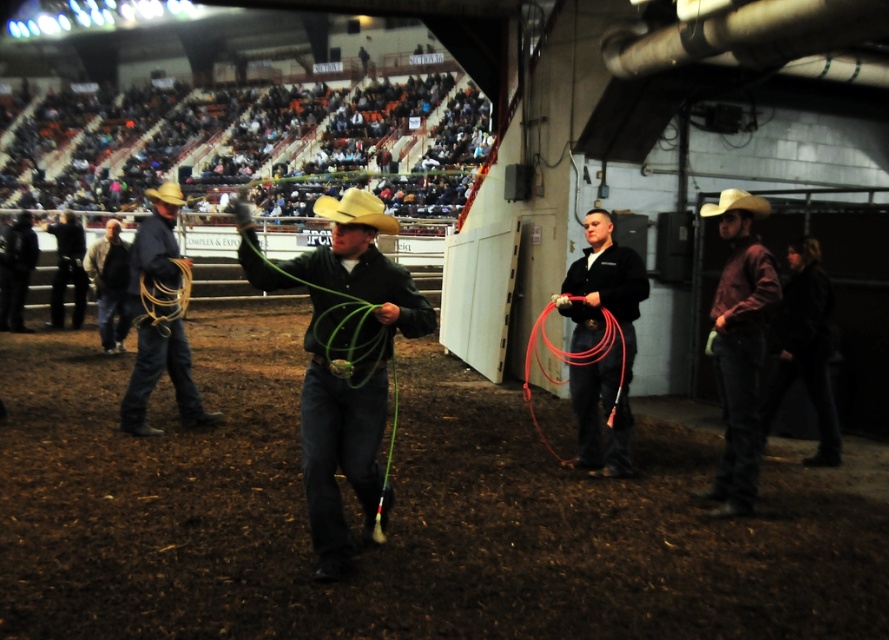
Question: Is matte black lasso at center above rustic leather cowboy hat at left?

Choices:
 (A) yes
 (B) no

Answer: (B)

Question: Which of these objects is positioned closest to the dark blue jeans at left?

Choices:
 (A) light brown felt cowboy hat at right
 (B) green matte rope at center

Answer: (B)

Question: Is black leather cowboy hat at left positioned at the back of yellow felt cowboy hat at center?

Choices:
 (A) no
 (B) yes

Answer: (B)

Question: Which point is farther to the camera?

Choices:
 (A) (23, 243)
 (B) (343, 556)

Answer: (A)

Question: Can you confirm if brown leather cowboy hat at right is positioned to the right of yellow felt cowboy hat at center?

Choices:
 (A) yes
 (B) no

Answer: (A)

Question: Which point appears farthest from the camera in this image?

Choices:
 (A) (175, 186)
 (B) (594, 269)
 (C) (9, 296)

Answer: (C)